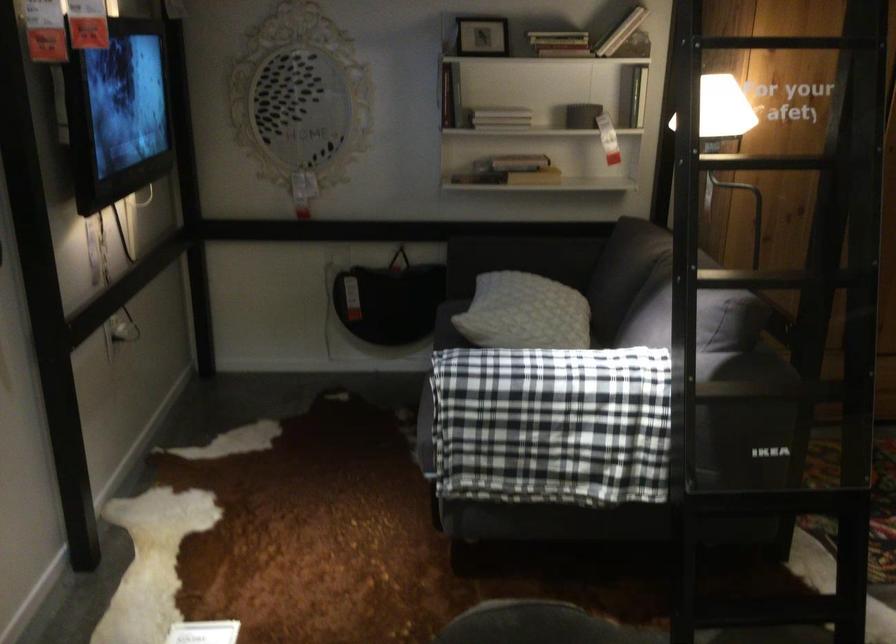
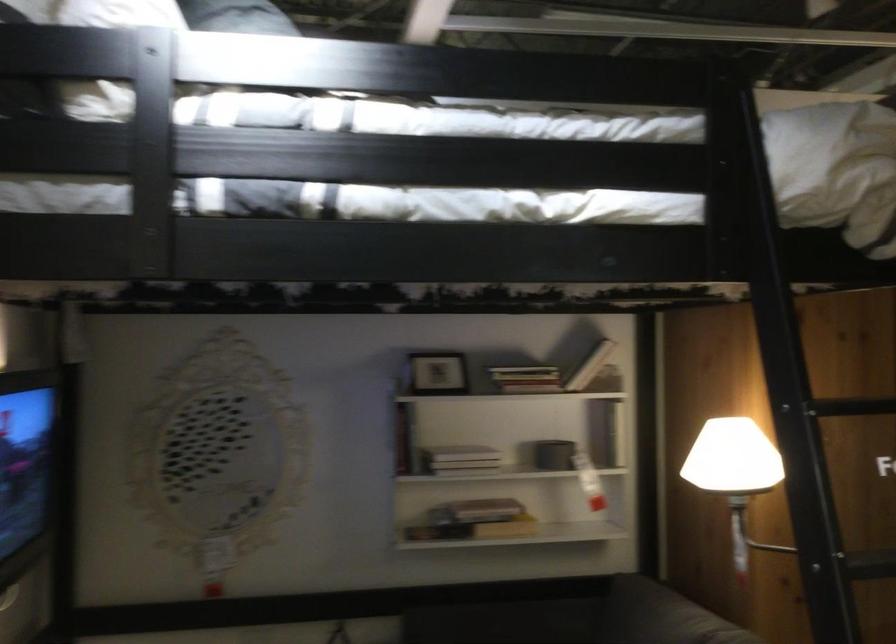
Which direction would the cameraman need to move to produce the second image?

The cameraman walked toward left, forward.